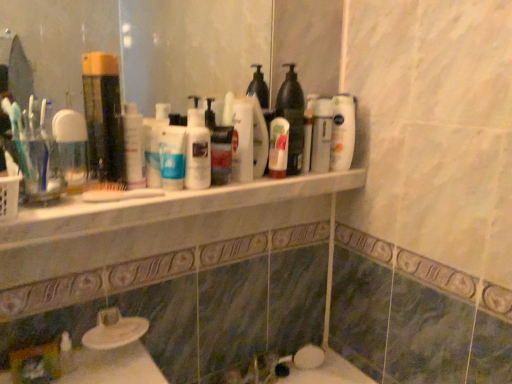
Identify the location of free point above white marble counter at center (from a real-world perspective). (209, 184).